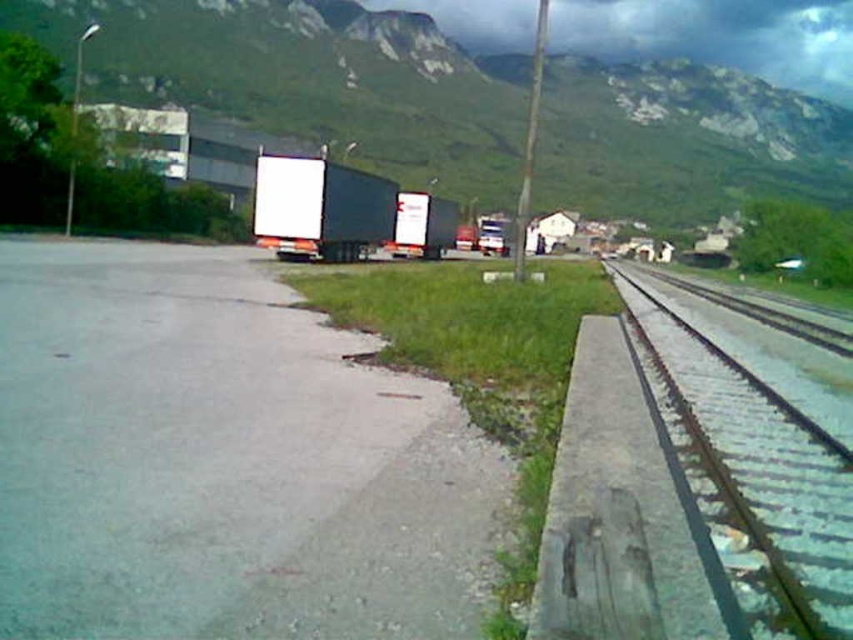
You are a hiker who wants to take a photo of the green metallic track at right from the green grassy mountain at upper center. Is the mountain above the track? Please explain.

Yes, the green grassy mountain at upper center is above the green metallic track at right, so you can take the photo from there.

You are a pedestrian standing at the edge of the road. You see the green metallic track at right and the matte black trailer truck at center. Which object is nearer to you?

The green metallic track at right is closer to the viewer than the matte black trailer truck at center, so the green metallic track at right is nearer to you.

You are a hiker standing at the base of the green grassy mountain at upper center and want to take a photo of the matte black trailer truck at center. Which object should you focus your camera on first to ensure it appears larger in the photo?

The green grassy mountain at upper center is taller than the matte black trailer truck at center, so you should focus your camera on the green grassy mountain at upper center first to capture its larger size in the photo.